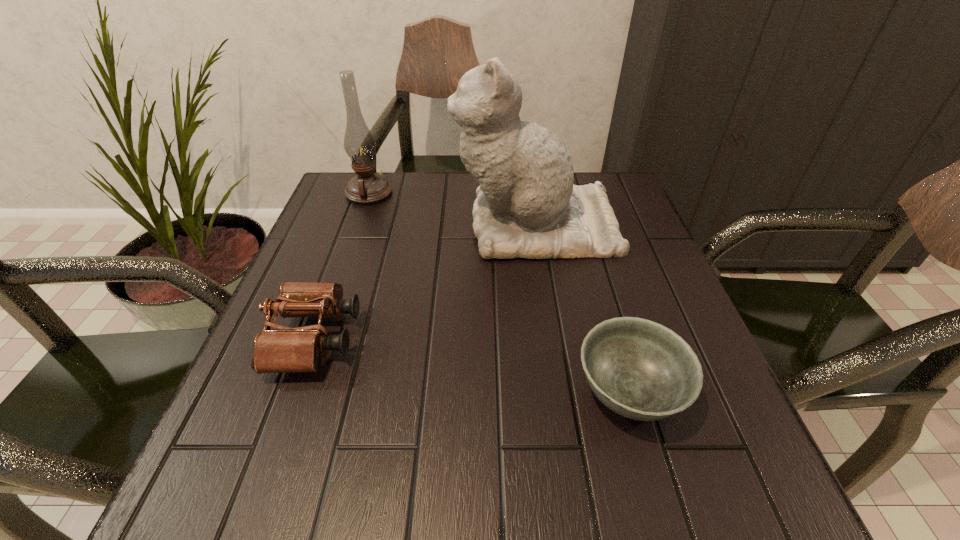
Locate an element on the screen. The width and height of the screenshot is (960, 540). blank region between the bowl and the tallest object is located at coordinates (582, 309).

Where is `free space between the second tallest object and the bowl`? free space between the second tallest object and the bowl is located at coordinates (499, 293).

The width and height of the screenshot is (960, 540). Find the location of `vacant region between the tallest object and the second tallest object`. vacant region between the tallest object and the second tallest object is located at coordinates (452, 210).

Find the location of a particular element. This screenshot has height=540, width=960. free spot between the binoculars and the cat is located at coordinates (425, 282).

This screenshot has width=960, height=540. I want to click on object that is the second closest to the cat, so click(x=284, y=349).

Select which object appears as the second closest to the binoculars. Please provide its 2D coordinates. Your answer should be formatted as a tuple, i.e. [(x, y)], where the tuple contains the x and y coordinates of a point satisfying the conditions above.

[(367, 187)]

The width and height of the screenshot is (960, 540). Find the location of `free spot that satisfies the following two spatial constraints: 1. on the front-facing side of the bowl; 2. on the right side of the cat`. free spot that satisfies the following two spatial constraints: 1. on the front-facing side of the bowl; 2. on the right side of the cat is located at coordinates point(562,392).

I want to click on vacant space that satisfies the following two spatial constraints: 1. on the front-facing side of the tallest object; 2. on the back side of the bowl, so click(x=562, y=392).

At what (x,y) coordinates should I click in order to perform the action: click on blank area in the image that satisfies the following two spatial constraints: 1. on the front-facing side of the cat; 2. on the back side of the bowl. Please return your answer as a coordinate pair (x, y). The width and height of the screenshot is (960, 540). Looking at the image, I should click on (562, 392).

Find the location of a particular element. This screenshot has height=540, width=960. vacant space that satisfies the following two spatial constraints: 1. through the eyepieces of the binoculars; 2. on the left side of the bowl is located at coordinates (296, 392).